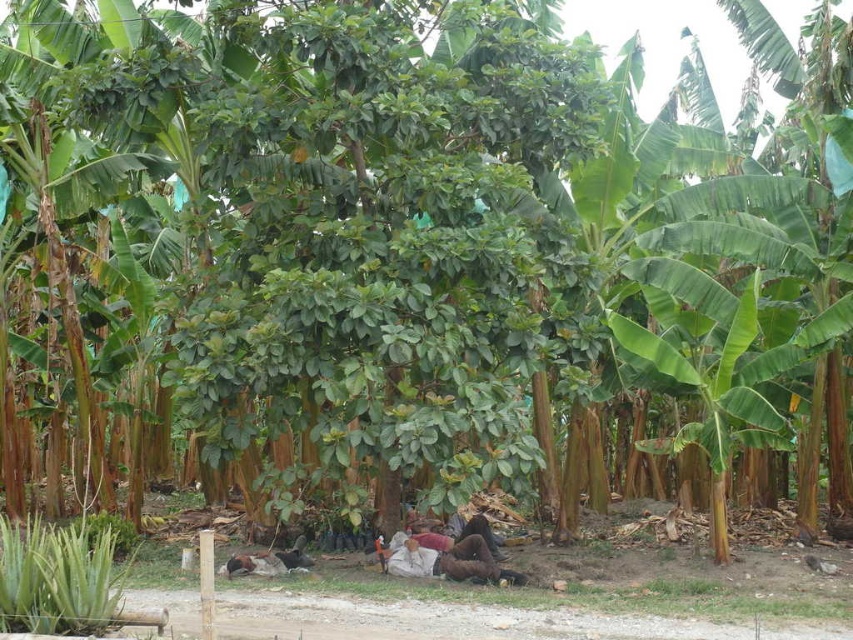
Is point (119, 620) in front of point (457, 541)?

That is True.

Identify the location of green leafy plant at lower left. (57, 577).

Between point (61, 588) and point (486, 547), which one is positioned in front?

Point (61, 588) is more forward.

Identify the location of green leafy plant at lower left. This screenshot has height=640, width=853. (57, 577).